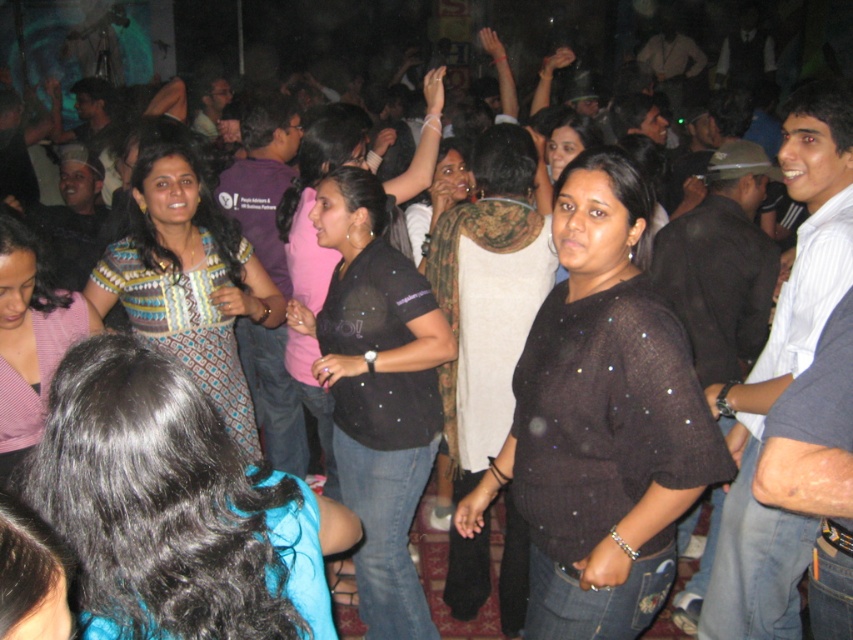
Is black mesh top at center positioned behind black textured shirt at center?

That is False.

Which is in front, point (701, 451) or point (434, 177)?

Point (701, 451) is in front.

Is point (648, 493) in front of point (444, 172)?

Yes, point (648, 493) is in front of point (444, 172).

Image resolution: width=853 pixels, height=640 pixels. I want to click on black mesh top at center, so click(x=601, y=420).

Where is `black glittery shirt at center`? This screenshot has height=640, width=853. black glittery shirt at center is located at coordinates (376, 390).

Who is shorter, black glittery shirt at center or black textured shirt at center?

With less height is black textured shirt at center.

Is point (399, 364) behind point (421, 237)?

No, (399, 364) is closer to viewer.

At what (x,y) coordinates should I click in order to perform the action: click on black glittery shirt at center. Please return your answer as a coordinate pair (x, y). The image size is (853, 640). Looking at the image, I should click on [x=376, y=390].

Who is positioned more to the left, blue fabric dress at center or patterned fabric dress at center?

From the viewer's perspective, patterned fabric dress at center appears more on the left side.

Can you confirm if blue fabric dress at center is thinner than patterned fabric dress at center?

Indeed, blue fabric dress at center has a lesser width compared to patterned fabric dress at center.

Which is in front, point (199, 410) or point (167, 344)?

Point (199, 410)

The height and width of the screenshot is (640, 853). Find the location of `blue fabric dress at center`. blue fabric dress at center is located at coordinates [173, 508].